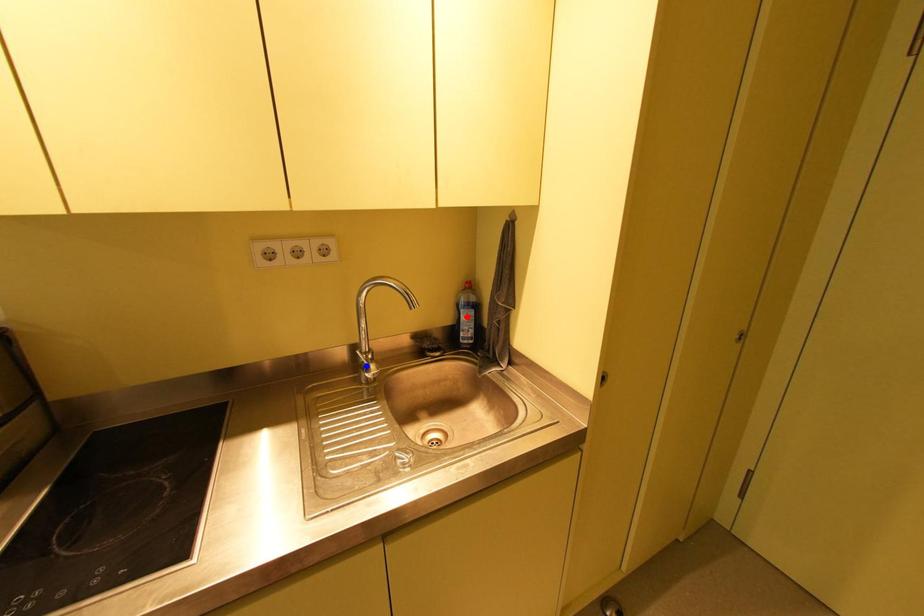
Question: In the image, two points are highlighted. Which point is nearer to the camera? Reply with the corresponding letter.

Choices:
 (A) blue point
 (B) red point

Answer: (A)